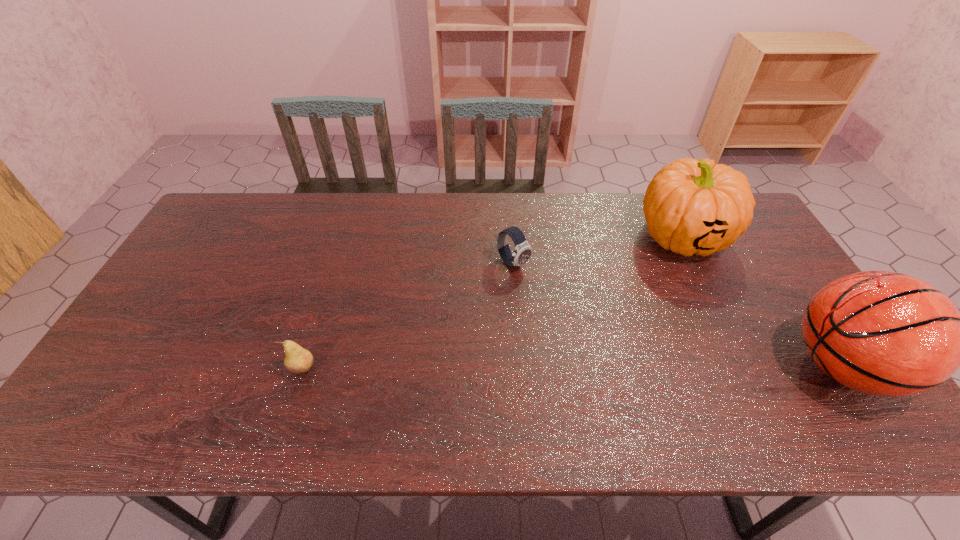
Find the location of a particular element. The width and height of the screenshot is (960, 540). the leftmost object is located at coordinates (298, 360).

This screenshot has width=960, height=540. I want to click on basketball, so click(883, 333).

Identify the location of watch. (523, 251).

Locate an element on the screen. The height and width of the screenshot is (540, 960). pumpkin is located at coordinates (692, 207).

Locate an element on the screen. free point located on the back of the pear is located at coordinates (313, 335).

What are the coordinates of `free space located 0.200m on the side with spill of the basketball` in the screenshot? It's located at (705, 367).

Identify the location of free space located 0.280m on the side with spill of the basketball. This screenshot has height=540, width=960. (672, 367).

The width and height of the screenshot is (960, 540). I want to click on free space located on the side with spill of the basketball, so click(701, 367).

Locate an element on the screen. The image size is (960, 540). vacant space located 0.050m on the face of the watch is located at coordinates (536, 284).

Where is `vacant space located 0.270m on the face of the watch`? This screenshot has height=540, width=960. vacant space located 0.270m on the face of the watch is located at coordinates (592, 332).